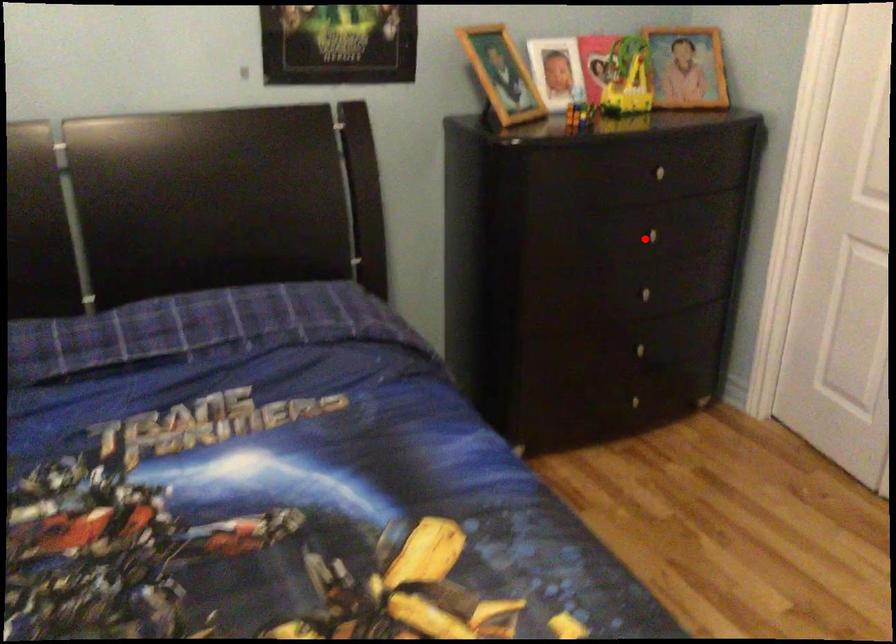
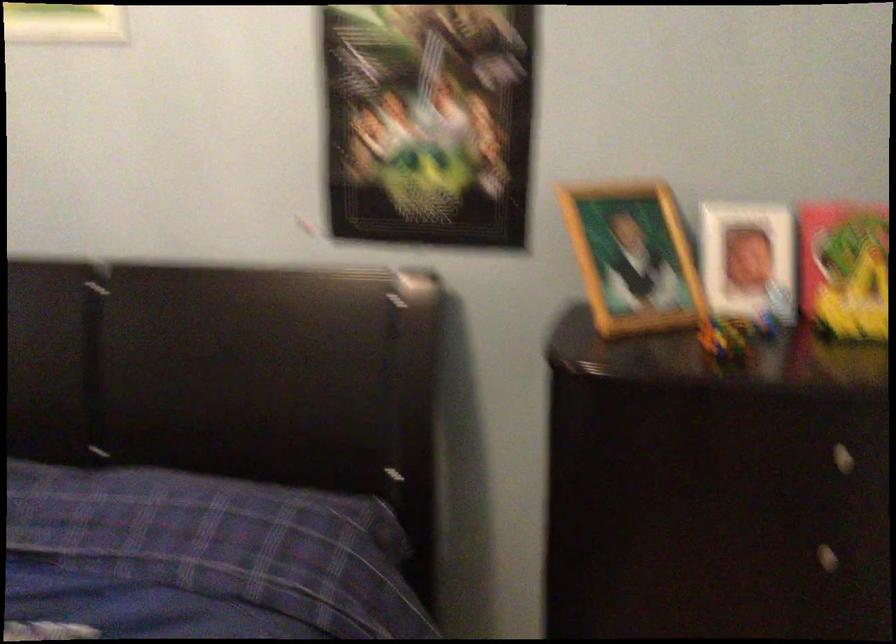
Question: I am providing you with two images of the same scene from different viewpoints. In image1, a red point is highlighted. Considering the same 3D point in image2, which of the following is correct?

Choices:
 (A) It is closer
 (B) It is farther

Answer: (A)